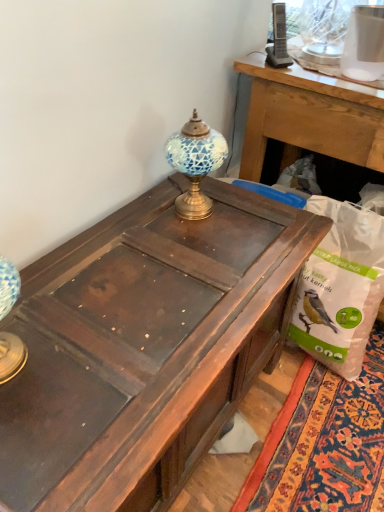
This screenshot has width=384, height=512. What are the coordinates of `vacant space to the right of blue mosaic glass at center` in the screenshot? It's located at (253, 212).